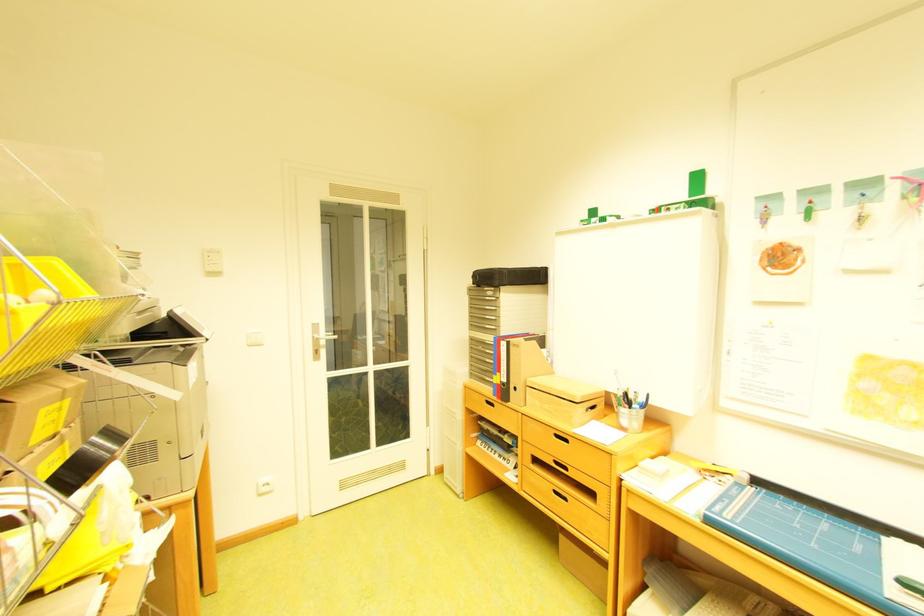
The width and height of the screenshot is (924, 616). I want to click on metal pen cup, so click(x=629, y=408).